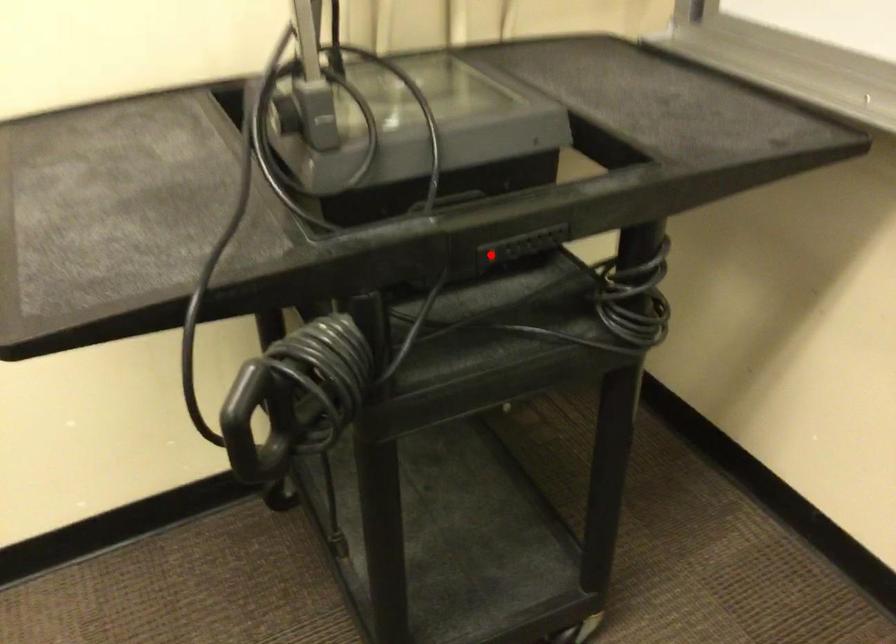
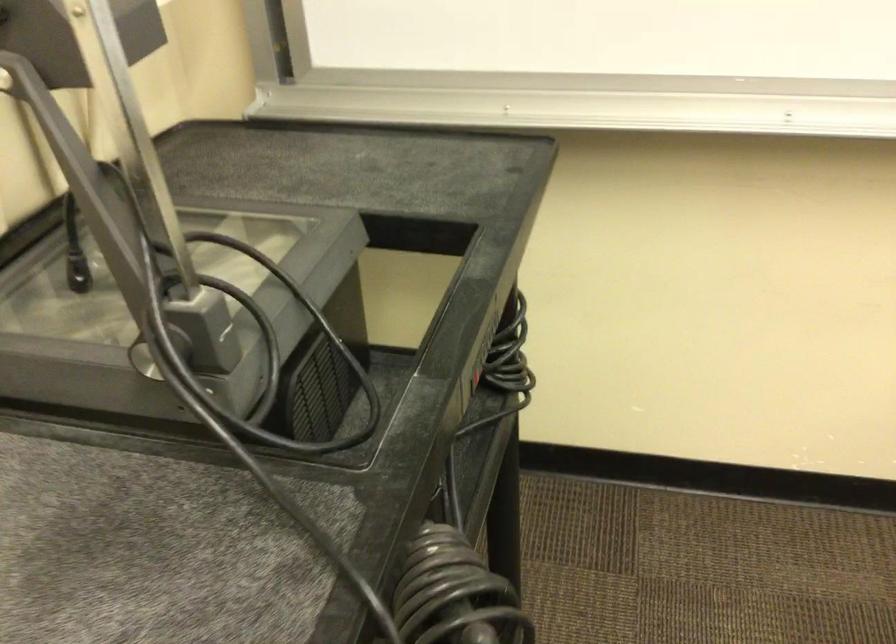
Question: I am providing you with two images of the same scene from different viewpoints. A red point is marked on the first image. Can you still see the location of the red point in image 2?

Choices:
 (A) Yes
 (B) No

Answer: (B)